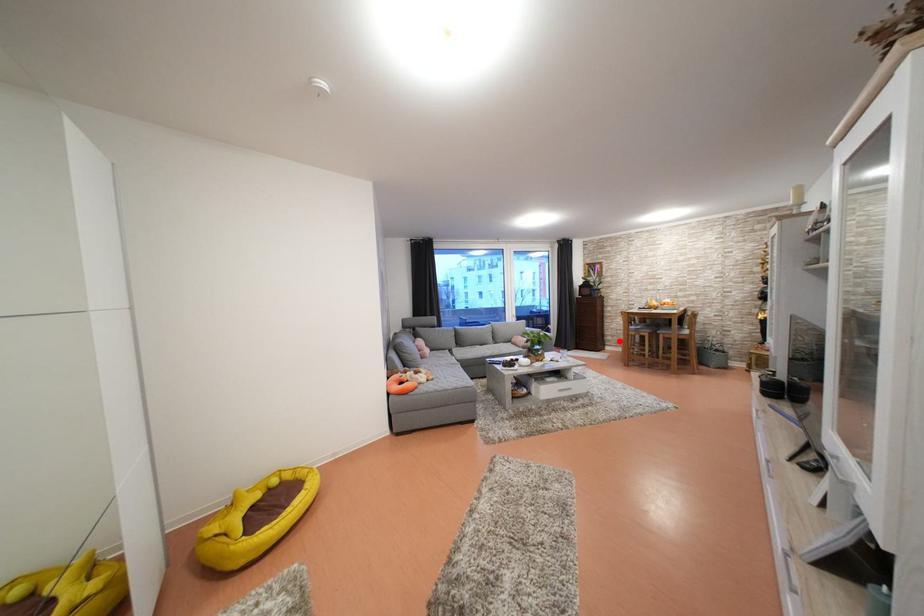
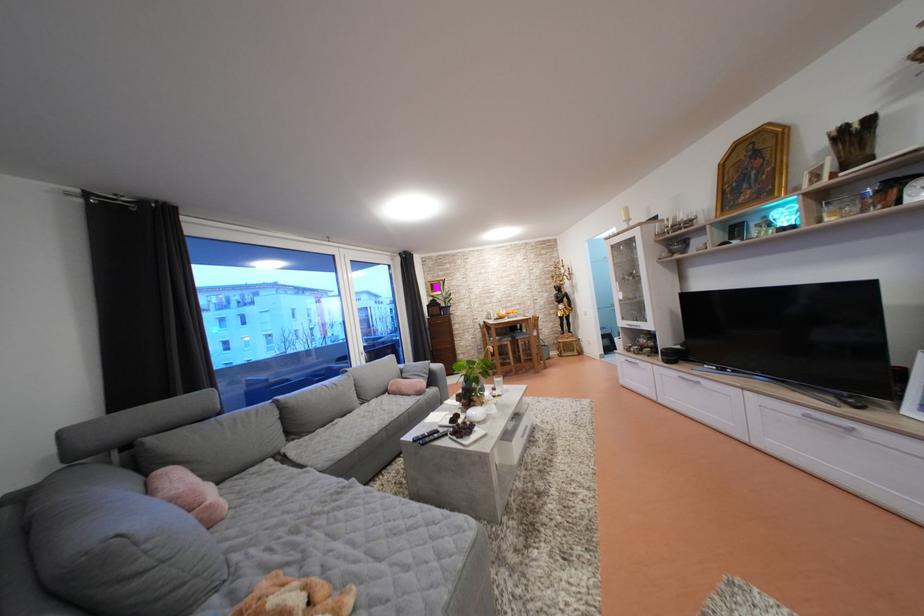
Question: I am providing you with two images of the same scene from different viewpoints. Given a red point in image1, look at the same physical point in image2. Is it:

Choices:
 (A) Closer to the viewpoint
 (B) Farther from the viewpoint

Answer: (A)